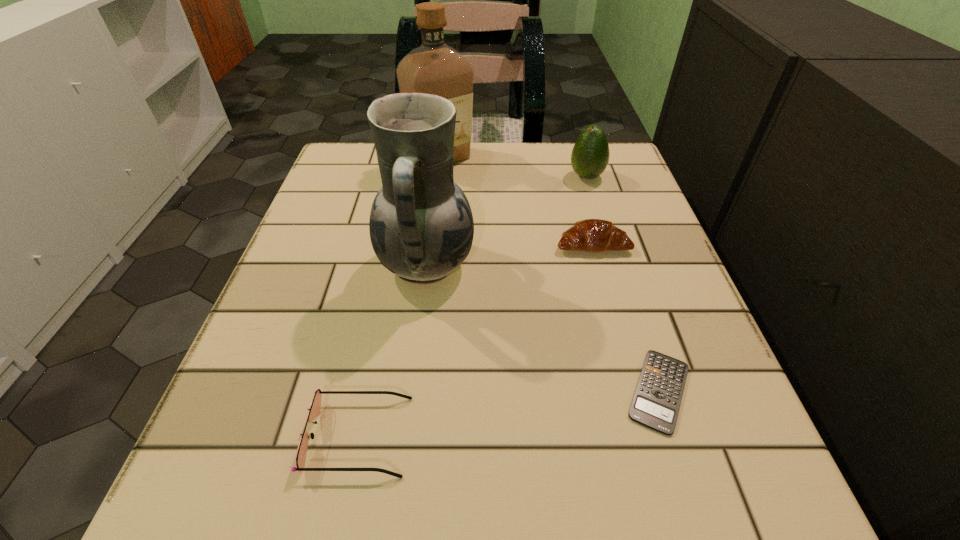
You are a GUI agent. You are given a task and a screenshot of the screen. Output one action in this format:
    pyautogui.click(x=<x>, y=<y>)
    Task: Click on the free point that satisfies the following two spatial constraints: 1. on the front-facing side of the calculator; 2. on the left side of the pitcher
    The height and width of the screenshot is (540, 960).
    Given the screenshot: What is the action you would take?
    pyautogui.click(x=411, y=391)

Where is `free point that satisfies the following two spatial constraints: 1. on the front-facing side of the calculator; 2. on the right side of the liquor`? The width and height of the screenshot is (960, 540). free point that satisfies the following two spatial constraints: 1. on the front-facing side of the calculator; 2. on the right side of the liquor is located at coordinates (413, 391).

The height and width of the screenshot is (540, 960). I want to click on vacant space that satisfies the following two spatial constraints: 1. on the front side of the calculator; 2. on the bridge of the second shortest object, so click(673, 436).

Find the location of `vacant area in the image that satisfies the following two spatial constraints: 1. on the front-facing side of the liquor; 2. on the bridge of the fifth tallest object`. vacant area in the image that satisfies the following two spatial constraints: 1. on the front-facing side of the liquor; 2. on the bridge of the fifth tallest object is located at coordinates (407, 436).

Locate an element on the screen. This screenshot has height=540, width=960. vacant space that satisfies the following two spatial constraints: 1. on the front-facing side of the pitcher; 2. on the left side of the shortest object is located at coordinates (411, 391).

Identify the location of vacant space that satisfies the following two spatial constraints: 1. on the front-facing side of the liquor; 2. on the left side of the crescent roll. This screenshot has width=960, height=540. (430, 244).